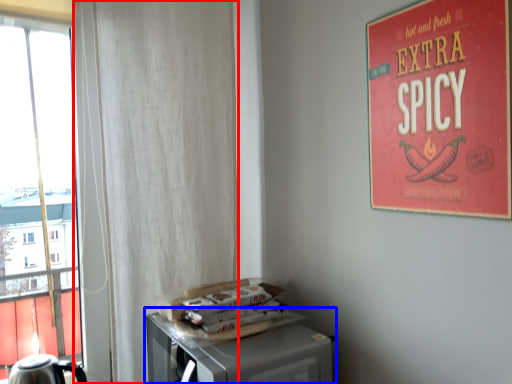
Question: Which object appears closest to the camera in this image, curtain (highlighted by a red box) or table (highlighted by a blue box)?

Choices:
 (A) curtain
 (B) table

Answer: (B)